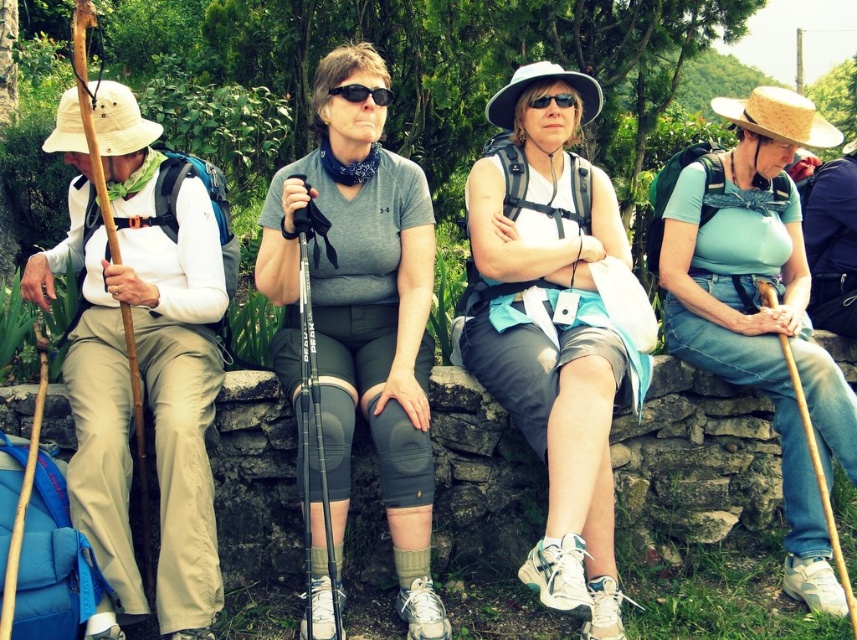
Question: Is white matte shorts at center to the left of gray matte knee pads at center from the viewer's perspective?

Choices:
 (A) no
 (B) yes

Answer: (A)

Question: Observing the image, what is the correct spatial positioning of gray matte knee pads at center in reference to light blue denim jeans at center?

Choices:
 (A) right
 (B) left

Answer: (B)

Question: Among these objects, which one is farthest from the camera?

Choices:
 (A) gray matte knee pads at center
 (B) white matte shorts at center
 (C) light blue denim jeans at center

Answer: (C)

Question: In this image, where is gray matte knee pads at center located relative to light blue denim jeans at center?

Choices:
 (A) left
 (B) right

Answer: (A)

Question: Which point is farther to the camera?

Choices:
 (A) gray matte knee pads at center
 (B) light blue denim jeans at center

Answer: (B)

Question: Considering the real-world distances, which object is farthest from the black matte sunglasses at center?

Choices:
 (A) light blue denim jeans at center
 (B) white matte shorts at center

Answer: (A)